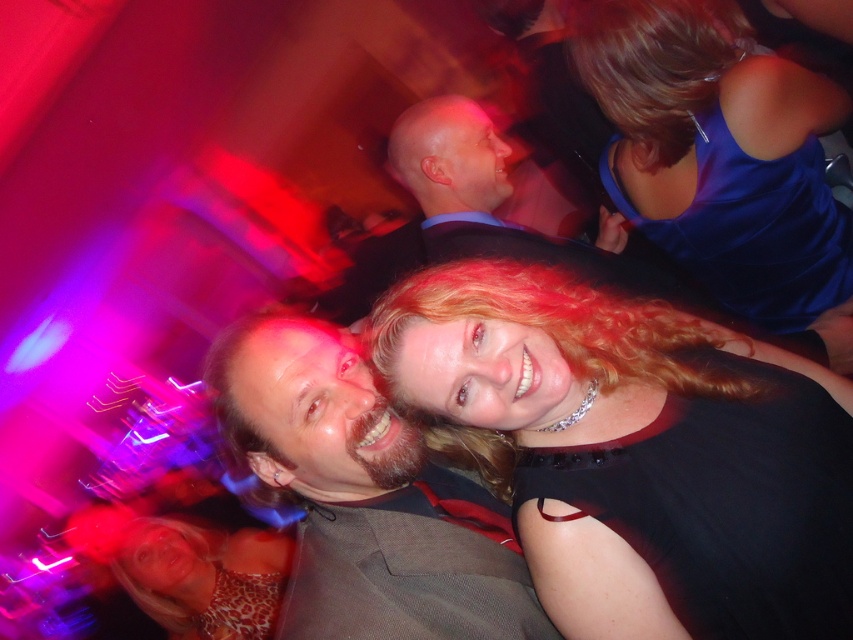
Does point (846, 368) come in front of point (192, 618)?

That is True.

Describe the element at coordinates (721, 157) in the screenshot. This screenshot has width=853, height=640. I see `shiny blue dress at upper right` at that location.

This screenshot has width=853, height=640. Find the location of `shiny blue dress at upper right`. shiny blue dress at upper right is located at coordinates (721, 157).

Can you confirm if dark brown leather jacket at center is thinner than leopard print dress at lower left?

Indeed, dark brown leather jacket at center has a lesser width compared to leopard print dress at lower left.

Is dark brown leather jacket at center to the left of leopard print dress at lower left from the viewer's perspective?

Incorrect, dark brown leather jacket at center is not on the left side of leopard print dress at lower left.

This screenshot has width=853, height=640. What are the coordinates of `dark brown leather jacket at center` in the screenshot? It's located at (364, 497).

What do you see at coordinates (364, 497) in the screenshot? I see `dark brown leather jacket at center` at bounding box center [364, 497].

Does dark brown leather jacket at center appear on the left side of shiny black suit at center?

Incorrect, dark brown leather jacket at center is not on the left side of shiny black suit at center.

The image size is (853, 640). I want to click on dark brown leather jacket at center, so click(364, 497).